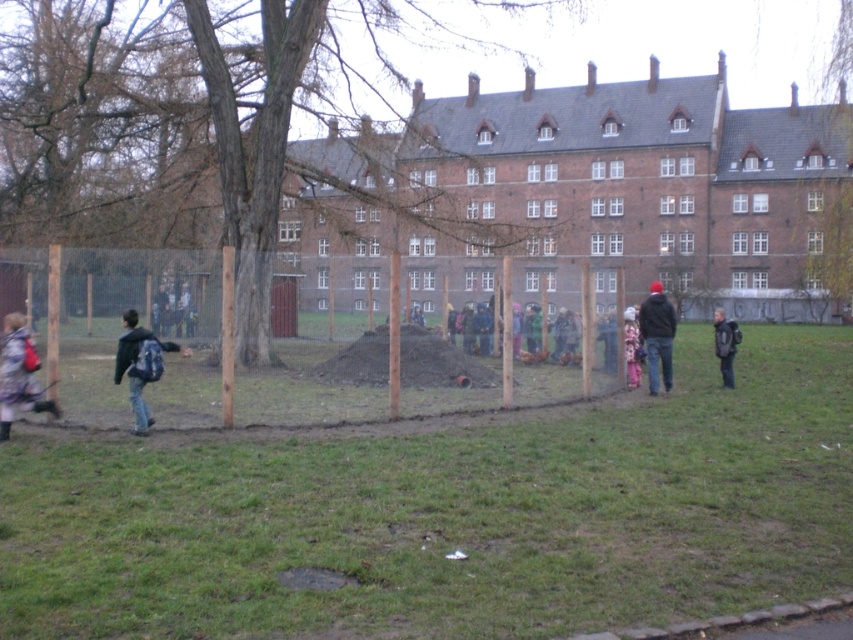
In the scene shown: You are a visitor at the park and want to take a photo of the dark gray backpack at right without the brown wooden fence at center blocking the view. Is this possible from your current position?

The brown wooden fence at center is in front of the dark gray backpack at right, so it is blocking the view. You would need to move to a position where the dark gray backpack at right is not behind the brown wooden fence at center to take a clear photo.